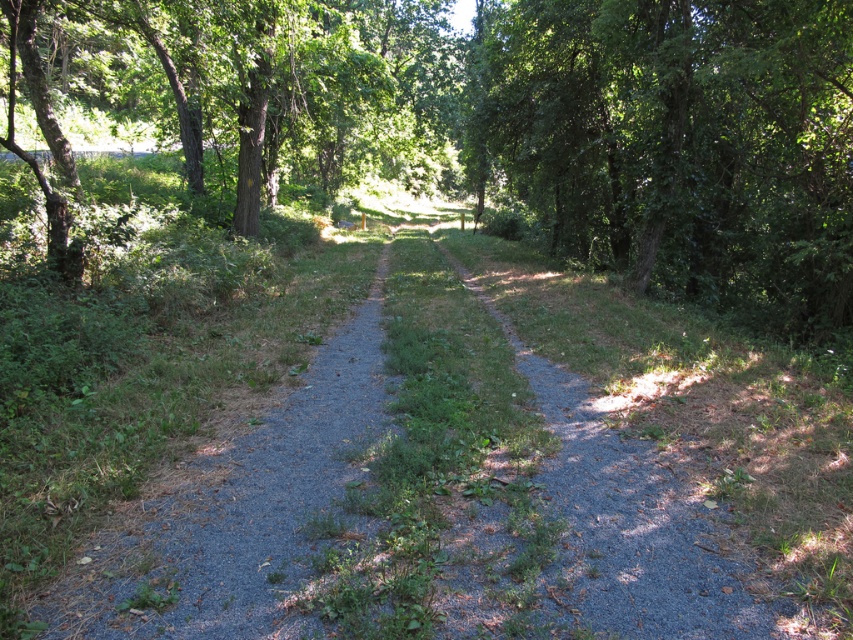
Question: Estimate the real-world distances between objects in this image. Which object is farther from the green leafy tree at center?

Choices:
 (A) gray gravel path at center
 (B) green leafy tree at right

Answer: (A)

Question: Which of the following is the farthest from the observer?

Choices:
 (A) green leafy tree at right
 (B) gray gravel path at center

Answer: (A)

Question: Can you confirm if green leafy tree at center is positioned to the right of gray gravel path at center?

Choices:
 (A) yes
 (B) no

Answer: (B)

Question: Can you confirm if gray gravel path at center is bigger than green leafy tree at right?

Choices:
 (A) no
 (B) yes

Answer: (A)

Question: Does green leafy tree at center lie behind green leafy tree at right?

Choices:
 (A) no
 (B) yes

Answer: (B)

Question: Which object is the closest to the green leafy tree at center?

Choices:
 (A) gray gravel path at center
 (B) green leafy tree at right

Answer: (B)